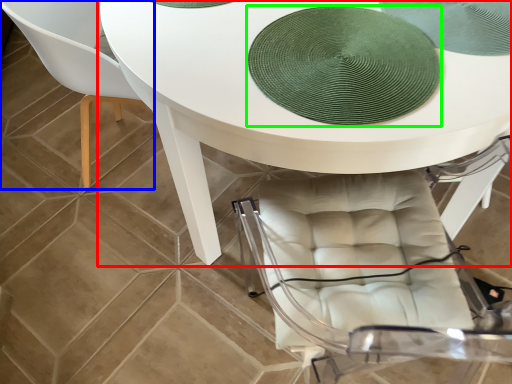
Question: Which object is positioned closest to table (highlighted by a red box)? Select from chair (highlighted by a blue box) and mat (highlighted by a green box).

Choices:
 (A) chair
 (B) mat

Answer: (B)